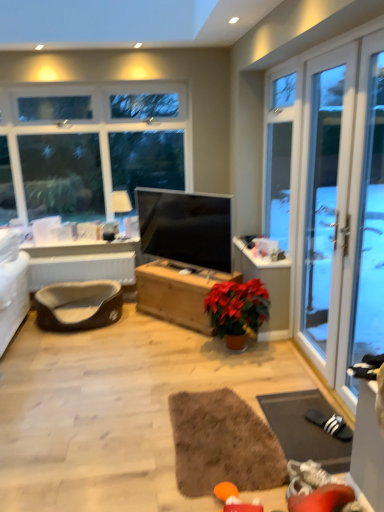
Identify the location of free space on the front side of wooden chest at center. The height and width of the screenshot is (512, 384). (153, 348).